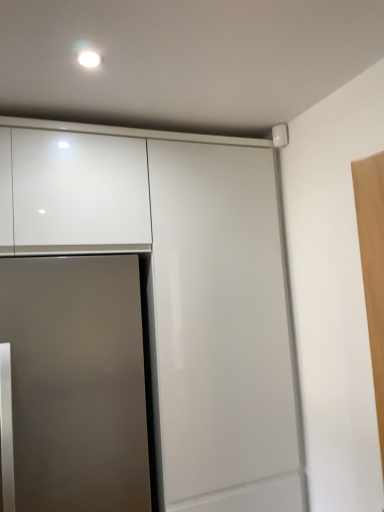
Question: Is glossy white cabinet at upper center in front of or behind satin silver door at lower left in the image?

Choices:
 (A) behind
 (B) front

Answer: (A)

Question: From the image's perspective, relative to satin silver door at lower left, is glossy white cabinet at upper center above or below?

Choices:
 (A) below
 (B) above

Answer: (B)

Question: Considering the positions of glossy white cabinet at upper center and satin silver door at lower left in the image, is glossy white cabinet at upper center wider or thinner than satin silver door at lower left?

Choices:
 (A) wide
 (B) thin

Answer: (B)

Question: In terms of size, does satin silver door at lower left appear bigger or smaller than glossy white cabinet at upper center?

Choices:
 (A) small
 (B) big

Answer: (A)

Question: Is satin silver door at lower left spatially inside glossy white cabinet at upper center, or outside of it?

Choices:
 (A) inside
 (B) outside

Answer: (A)

Question: From a real-world perspective, is satin silver door at lower left physically located above or below glossy white cabinet at upper center?

Choices:
 (A) above
 (B) below

Answer: (B)

Question: Considering the positions of satin silver door at lower left and glossy white cabinet at upper center in the image, is satin silver door at lower left wider or thinner than glossy white cabinet at upper center?

Choices:
 (A) thin
 (B) wide

Answer: (B)